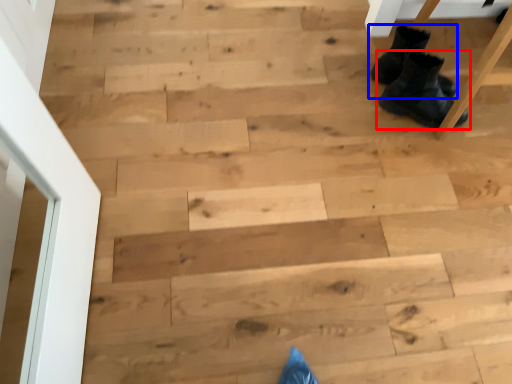
Question: Which point is further to the camera, footwear (highlighted by a red box) or footwear (highlighted by a blue box)?

Choices:
 (A) footwear
 (B) footwear

Answer: (B)